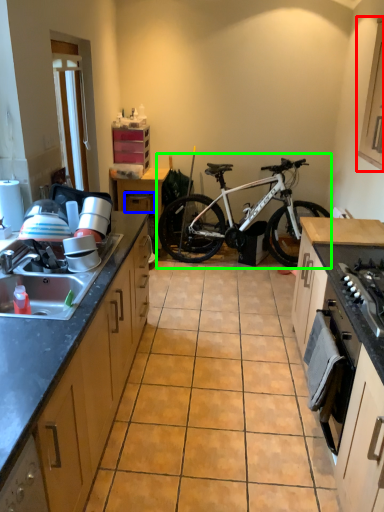
Question: Estimate the real-world distances between objects in this image. Which object is farther from cabinetry (highlighted by a red box), drawer (highlighted by a blue box) or bicycle (highlighted by a green box)?

Choices:
 (A) drawer
 (B) bicycle

Answer: (A)